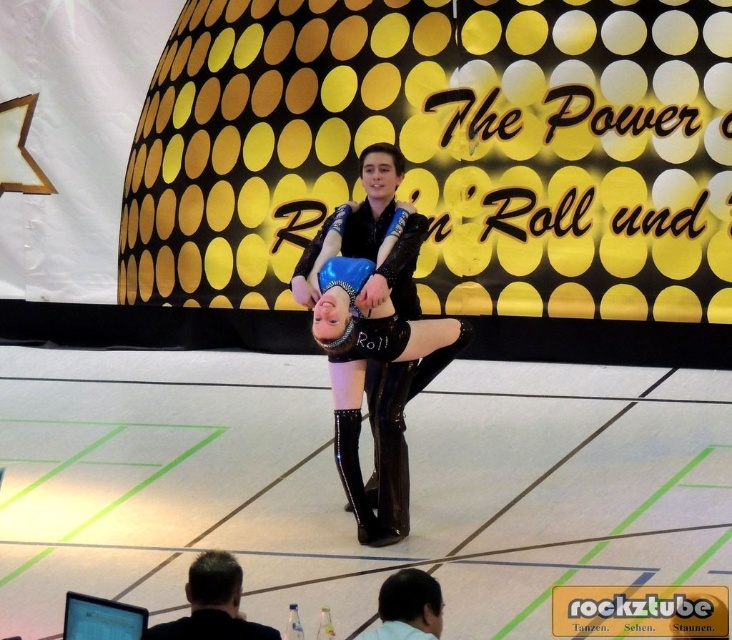
Question: Does glossy blue dress at center appear on the left side of black leather boot at center?

Choices:
 (A) yes
 (B) no

Answer: (B)

Question: From the image, what is the correct spatial relationship of glossy blue dress at center in relation to black leather boot at center?

Choices:
 (A) above
 (B) below

Answer: (A)

Question: Does glossy blue dress at center have a greater width compared to black leather boot at center?

Choices:
 (A) no
 (B) yes

Answer: (B)